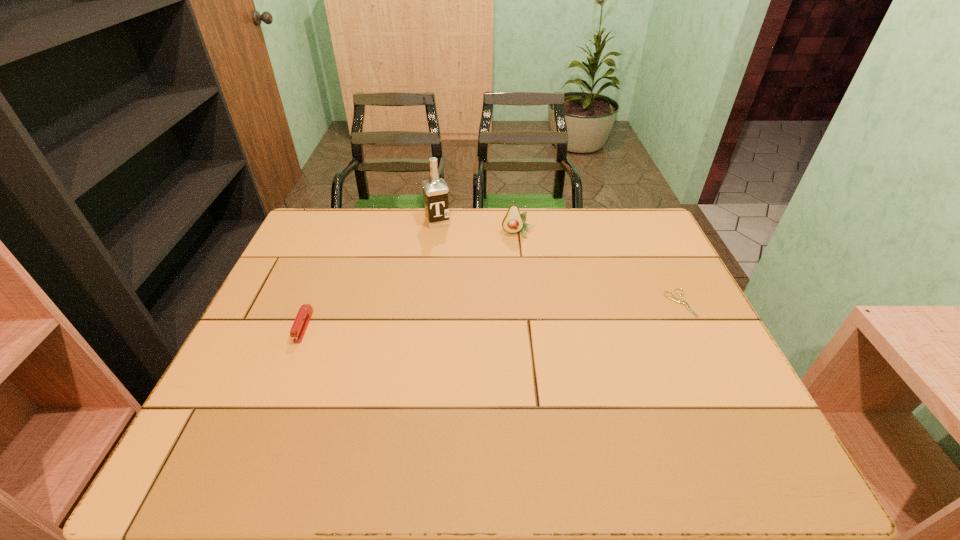
Where is `vacant space situated 0.340m on the front label of the third object from right to left`? The image size is (960, 540). vacant space situated 0.340m on the front label of the third object from right to left is located at coordinates (472, 296).

This screenshot has height=540, width=960. In order to click on vacant space located 0.300m on the front label of the third object from right to left in this screenshot , I will do `click(468, 287)`.

Locate an element on the screen. The width and height of the screenshot is (960, 540). vacant space positioned 0.210m on the front label of the third object from right to left is located at coordinates (459, 268).

Find the location of a particular element. vacant position located on the seed side of the avocado is located at coordinates (525, 278).

Identify the location of free space located on the seed side of the avocado. (521, 252).

Locate an element on the screen. blank space located 0.370m on the seed side of the avocado is located at coordinates (532, 324).

Where is `vodka situated at the far edge`? vodka situated at the far edge is located at coordinates (435, 190).

Image resolution: width=960 pixels, height=540 pixels. I want to click on avocado that is positioned at the far edge, so click(x=513, y=222).

Where is `object that is at the left edge`? This screenshot has width=960, height=540. object that is at the left edge is located at coordinates (303, 317).

The height and width of the screenshot is (540, 960). I want to click on object positioned at the right edge, so click(672, 297).